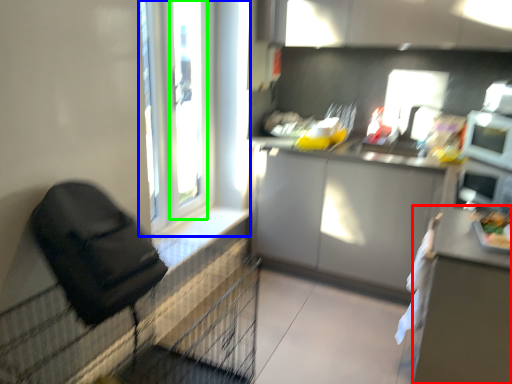
Question: Based on their relative distances, which object is farther from table (highlighted by a red box)? Choose from window (highlighted by a blue box) and window frame (highlighted by a green box).

Choices:
 (A) window
 (B) window frame

Answer: (B)